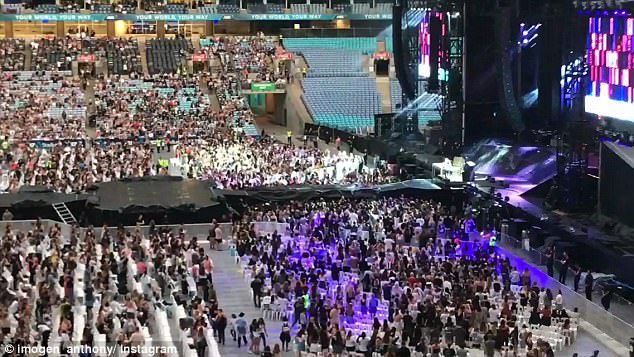
Image resolution: width=634 pixels, height=357 pixels. I want to click on ladder, so pos(66,215).